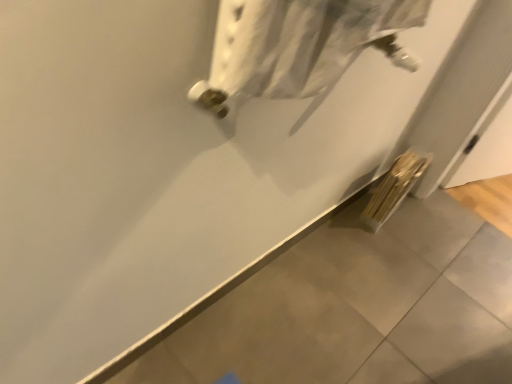
What are the coordinates of `free spot to the right of wooden sticks at lower right` in the screenshot? It's located at (419, 225).